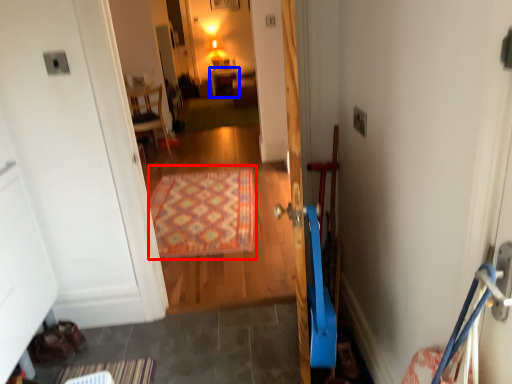
Question: Which of the following is the closest to the observer, doormat (highlighted by a red box) or furniture (highlighted by a blue box)?

Choices:
 (A) doormat
 (B) furniture

Answer: (A)